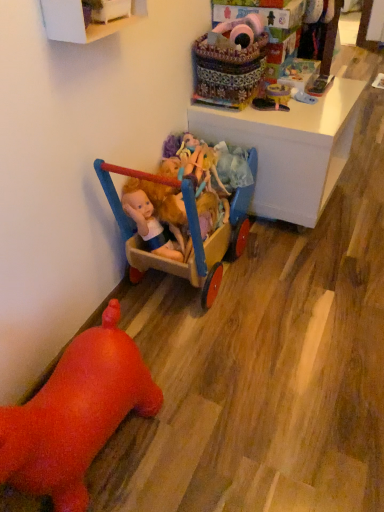
You are a GUI agent. You are given a task and a screenshot of the screen. Output one action in this format:
    pyautogui.click(x=<x>, y=<y>)
    Task: Click on the free spot to the right of rubber duck at lower left, the 6th toy when ordered from top to bottom
    
    Given the screenshot: What is the action you would take?
    pyautogui.click(x=228, y=432)